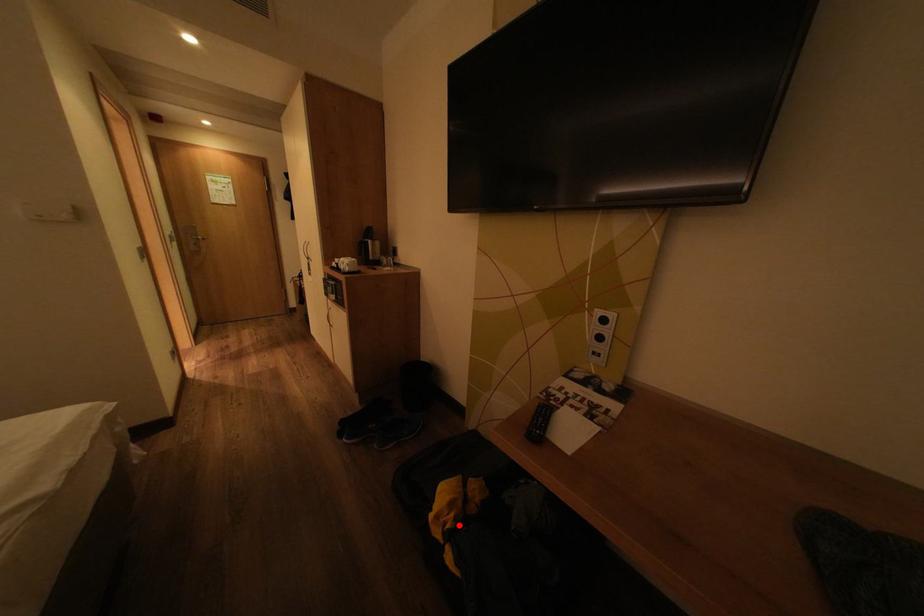
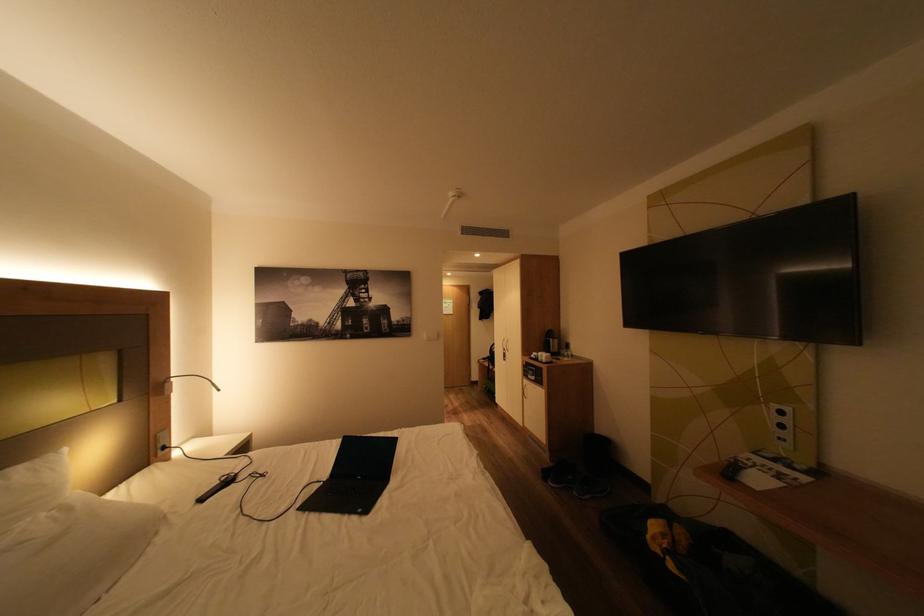
Where in the second image is the point corresponding to the highlighted location from the first image?

(675, 546)